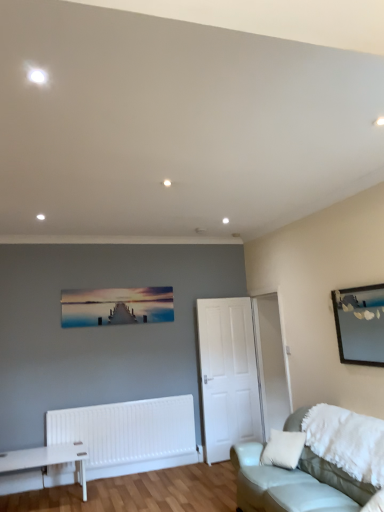
This screenshot has width=384, height=512. Describe the element at coordinates (116, 306) in the screenshot. I see `matte wooden pier at center, placed as the 1th picture frame when sorted from left to right` at that location.

Image resolution: width=384 pixels, height=512 pixels. What do you see at coordinates (294, 483) in the screenshot?
I see `leather couch at lower right` at bounding box center [294, 483].

What do you see at coordinates (360, 324) in the screenshot? I see `wooden mirror at upper right, the second picture frame from the left` at bounding box center [360, 324].

The image size is (384, 512). What do you see at coordinates (227, 375) in the screenshot? I see `white matte door at center` at bounding box center [227, 375].

Find the location of a particular element. The width and height of the screenshot is (384, 512). white matte door at center is located at coordinates (227, 375).

Locate an element on the screen. matte wooden pier at center, the second picture frame viewed from the right is located at coordinates (116, 306).

Is leather couch at lower right inside or outside of wooden mirror at upper right, the first picture frame positioned from the right?

leather couch at lower right is located beyond the bounds of wooden mirror at upper right, the first picture frame positioned from the right.

Who is shorter, leather couch at lower right or wooden mirror at upper right, the 2th picture frame from the back?

With less height is wooden mirror at upper right, the 2th picture frame from the back.

Which is more to the left, leather couch at lower right or wooden mirror at upper right, the first picture frame positioned from the right?

leather couch at lower right.

Does leather couch at lower right lie in front of wooden mirror at upper right, the second picture frame from the left?

Yes, it is in front of wooden mirror at upper right, the second picture frame from the left.

From a real-world perspective, which is physically above, white matte door at center or matte wooden pier at center, the second picture frame viewed from the right?

In real-world perspective, matte wooden pier at center, the second picture frame viewed from the right, is above.

Is white matte door at center positioned behind matte wooden pier at center, placed as the 1th picture frame when sorted from left to right?

Yes, white matte door at center is further from the camera.

How different are the orientations of white matte door at center and matte wooden pier at center, the 2th picture frame from the front, in degrees?

There is a 5.39-degree angle between the facing directions of white matte door at center and matte wooden pier at center, the 2th picture frame from the front.

Which of these two, white matte door at center or matte wooden pier at center, the 2th picture frame from the front, stands shorter?

matte wooden pier at center, the 2th picture frame from the front, is shorter.

Looking at this image, considering their positions, is leather couch at lower right located in front of or behind white matte door at center?

Visually, leather couch at lower right is located in front of white matte door at center.

Looking at their sizes, would you say leather couch at lower right is wider or thinner than white matte door at center?

Considering their sizes, leather couch at lower right looks broader than white matte door at center.

Considering the relative positions of leather couch at lower right and white matte door at center in the image provided, is leather couch at lower right to the right of white matte door at center from the viewer's perspective?

Yes.

From the image's perspective, is leather couch at lower right positioned above or below white matte door at center?

leather couch at lower right is situated lower than white matte door at center in the image.

Is white matte door at center facing towards wooden mirror at upper right, arranged as the first picture frame when viewed from the front?

Yes, white matte door at center is facing wooden mirror at upper right, arranged as the first picture frame when viewed from the front.

From a real-world perspective, relative to wooden mirror at upper right, the first picture frame positioned from the right, is white matte door at center vertically above or below?

In terms of real-world spatial position, white matte door at center is below wooden mirror at upper right, the first picture frame positioned from the right.

Would you say white matte door at center is outside wooden mirror at upper right, the 2th picture frame from the back?

Absolutely, white matte door at center is external to wooden mirror at upper right, the 2th picture frame from the back.

Which of these two, leather couch at lower right or matte wooden pier at center, placed as the 1th picture frame when sorted from back to front, is thinner?

matte wooden pier at center, placed as the 1th picture frame when sorted from back to front, is thinner.

Based on their positions, is leather couch at lower right located to the left or right of matte wooden pier at center, placed as the 1th picture frame when sorted from left to right?

Clearly, leather couch at lower right is on the right of matte wooden pier at center, placed as the 1th picture frame when sorted from left to right, in the image.

Could you tell me if leather couch at lower right is turned towards matte wooden pier at center, the 2th picture frame from the front?

No, leather couch at lower right is not turned towards matte wooden pier at center, the 2th picture frame from the front.

Is there a large distance between leather couch at lower right and matte wooden pier at center, placed as the 1th picture frame when sorted from back to front?

Yes, leather couch at lower right is far from matte wooden pier at center, placed as the 1th picture frame when sorted from back to front.

Can you confirm if matte wooden pier at center, placed as the 1th picture frame when sorted from left to right, is thinner than wooden mirror at upper right, arranged as the first picture frame when viewed from the front?

Yes.

Can you confirm if matte wooden pier at center, placed as the 1th picture frame when sorted from left to right, is taller than wooden mirror at upper right, the first picture frame positioned from the right?

No, matte wooden pier at center, placed as the 1th picture frame when sorted from left to right, is not taller than wooden mirror at upper right, the first picture frame positioned from the right.

From the image's perspective, which one is positioned lower, matte wooden pier at center, placed as the 1th picture frame when sorted from back to front, or wooden mirror at upper right, the first picture frame positioned from the right?

matte wooden pier at center, placed as the 1th picture frame when sorted from back to front, appears lower in the image.

Between wooden mirror at upper right, the second picture frame from the left, and white matte door at center, which one is positioned in front?

wooden mirror at upper right, the second picture frame from the left, is more forward.

In the scene shown: How different are the orientations of wooden mirror at upper right, the second picture frame from the left, and white matte door at center in degrees?

They differ by 95.4 degrees in their facing directions.

Is wooden mirror at upper right, the 2th picture frame from the back, at the right side of white matte door at center?

Yes, wooden mirror at upper right, the 2th picture frame from the back, is to the right of white matte door at center.

Which is closer, (x=335, y=290) or (x=243, y=439)?

Point (x=335, y=290).

Where is `studio couch in front of the wooden mirror at upper right, the second picture frame from the left`? The height and width of the screenshot is (512, 384). studio couch in front of the wooden mirror at upper right, the second picture frame from the left is located at coordinates (294, 483).

Identify the location of door located underneath the matte wooden pier at center, placed as the 1th picture frame when sorted from left to right (from a real-world perspective). This screenshot has height=512, width=384. (227, 375).

When comparing their distances from leather couch at lower right, does matte wooden pier at center, the 2th picture frame from the front, or wooden mirror at upper right, the second picture frame from the left, seem closer?

wooden mirror at upper right, the second picture frame from the left, is positioned closer to the anchor leather couch at lower right.

In the scene shown: Looking at the image, which one is located closer to white matte door at center, wooden mirror at upper right, the 2th picture frame from the back, or leather couch at lower right?

leather couch at lower right lies closer to white matte door at center than the other object.

Considering their positions, is leather couch at lower right positioned closer to wooden mirror at upper right, the 2th picture frame from the back, than white matte door at center?

Based on the image, leather couch at lower right appears to be nearer to wooden mirror at upper right, the 2th picture frame from the back.

In the scene shown: Looking at the image, which one is located further to matte wooden pier at center, placed as the 1th picture frame when sorted from back to front, white matte door at center or wooden mirror at upper right, the second picture frame from the left?

wooden mirror at upper right, the second picture frame from the left, lies further to matte wooden pier at center, placed as the 1th picture frame when sorted from back to front, than the other object.

Considering their positions, is white matte door at center positioned closer to matte wooden pier at center, placed as the 1th picture frame when sorted from left to right, than leather couch at lower right?

Based on the image, white matte door at center appears to be nearer to matte wooden pier at center, placed as the 1th picture frame when sorted from left to right.

Considering their positions, is white matte door at center positioned closer to wooden mirror at upper right, the second picture frame from the left, than matte wooden pier at center, the second picture frame viewed from the right?

white matte door at center.

Considering their positions, is leather couch at lower right positioned further to white matte door at center than wooden mirror at upper right, arranged as the first picture frame when viewed from the front?

wooden mirror at upper right, arranged as the first picture frame when viewed from the front, is positioned further to the anchor white matte door at center.

From the image, which object appears to be farther from leather couch at lower right, matte wooden pier at center, the second picture frame viewed from the right, or white matte door at center?

Based on the image, matte wooden pier at center, the second picture frame viewed from the right, appears to be further to leather couch at lower right.

Identify the location of picture frame positioned between leather couch at lower right and matte wooden pier at center, placed as the 1th picture frame when sorted from back to front, from near to far. The width and height of the screenshot is (384, 512). click(360, 324).

Find the location of a particular element. This screenshot has width=384, height=512. door between matte wooden pier at center, the second picture frame viewed from the right, and wooden mirror at upper right, the 2th picture frame from the back, from left to right is located at coordinates (227, 375).